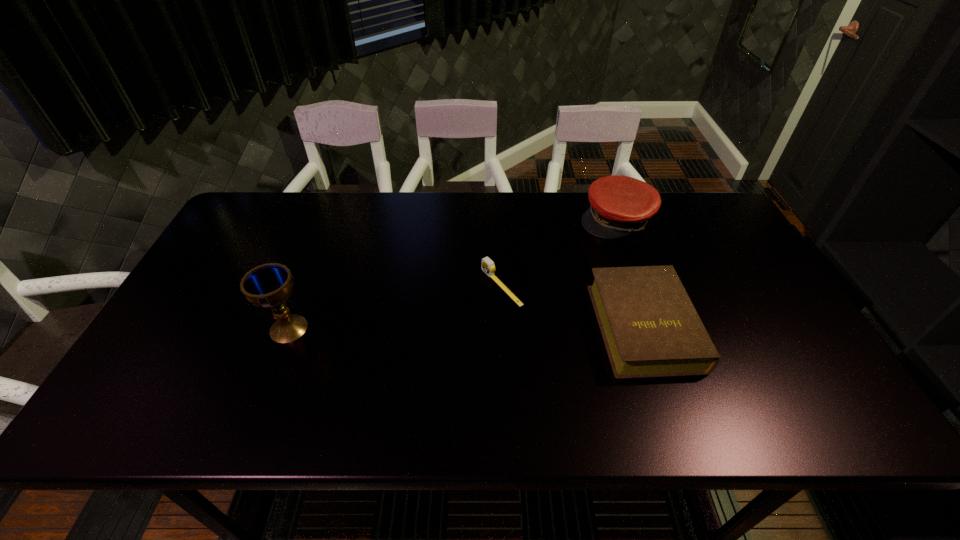
You are a GUI agent. You are given a task and a screenshot of the screen. Output one action in this format:
    pyautogui.click(x=<x>, y=<y>)
    Task: Click on the blank area at the right edge
    This screenshot has height=540, width=960.
    Given the screenshot: What is the action you would take?
    pyautogui.click(x=744, y=259)

The height and width of the screenshot is (540, 960). I want to click on free space at the far left corner of the desktop, so click(252, 223).

Image resolution: width=960 pixels, height=540 pixels. In order to click on free region at the near right corner of the desktop in this screenshot , I will do `click(790, 375)`.

The height and width of the screenshot is (540, 960). What are the coordinates of `vacant space in between the leftmost object and the Bible` in the screenshot? It's located at (466, 328).

Where is `vacant area that lies between the shortest object and the Bible`? The image size is (960, 540). vacant area that lies between the shortest object and the Bible is located at coordinates (x=572, y=307).

At what (x,y) coordinates should I click in order to perform the action: click on vacant area that lies between the farthest object and the shortest object. Please return your answer as a coordinate pair (x, y). The height and width of the screenshot is (540, 960). Looking at the image, I should click on (559, 253).

This screenshot has width=960, height=540. I want to click on vacant area that lies between the third tallest object and the shortest object, so click(572, 307).

The image size is (960, 540). In order to click on unoccupied area between the third object from right to left and the third tallest object in this screenshot , I will do `click(572, 307)`.

I want to click on vacant space that is in between the chalice and the tape measure, so click(396, 307).

Locate an element on the screen. The image size is (960, 540). vacant area that lies between the leftmost object and the third shortest object is located at coordinates (452, 274).